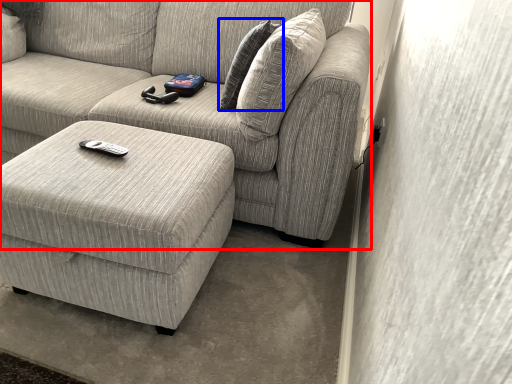
Question: Which object is further to the camera taking this photo, studio couch (highlighted by a red box) or pillow (highlighted by a blue box)?

Choices:
 (A) studio couch
 (B) pillow

Answer: (B)